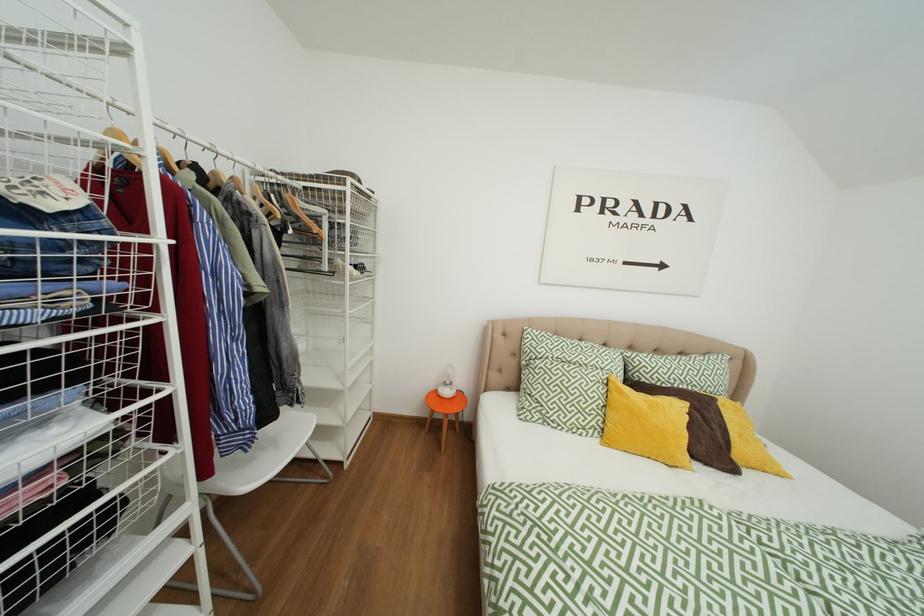
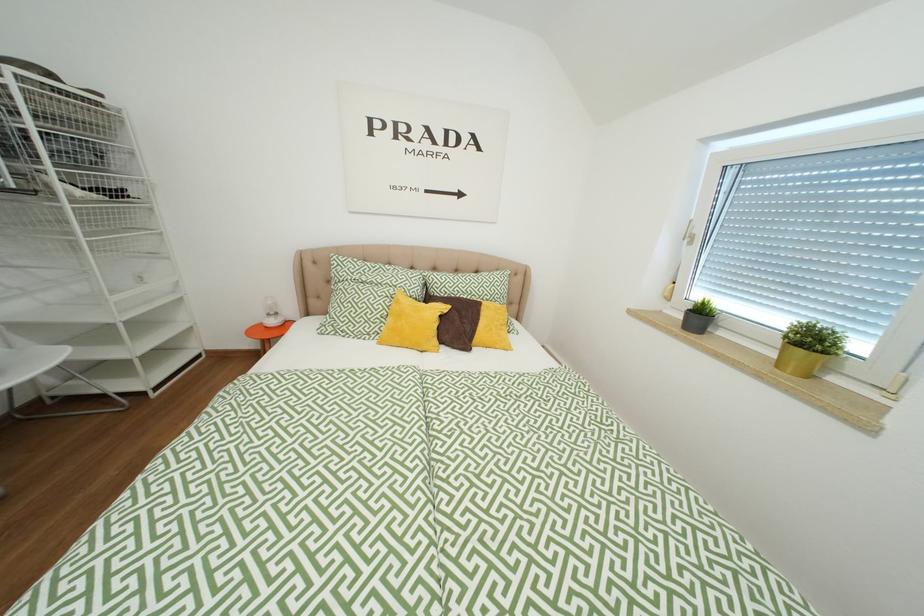
Question: What movement of the cameraman would produce the second image?

Choices:
 (A) Left
 (B) Right
 (C) Forward
 (D) Backward

Answer: (B)